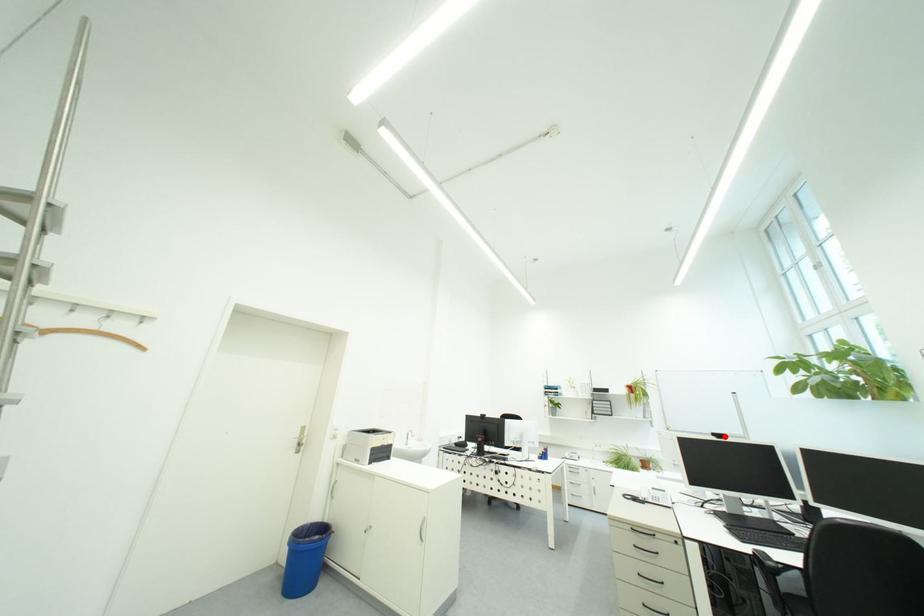
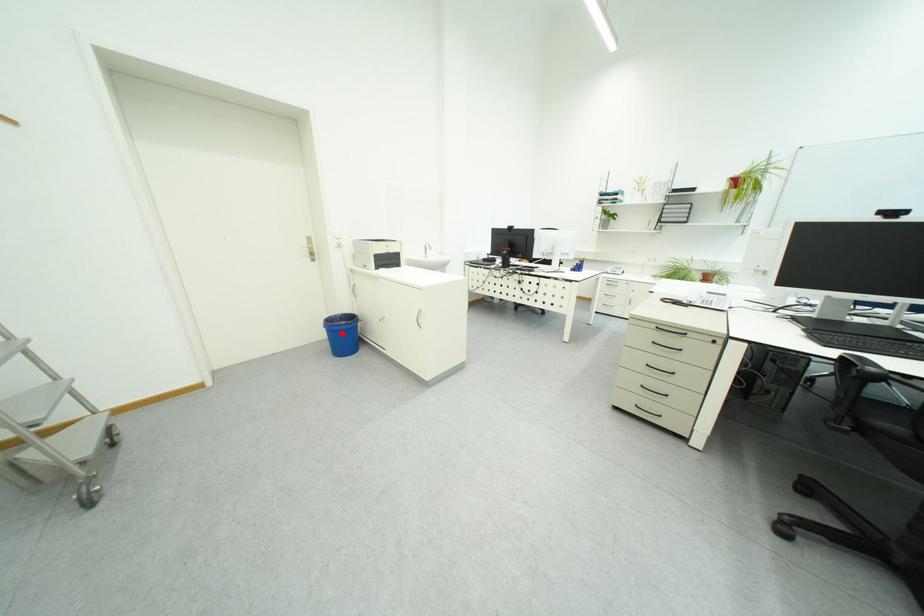
Looking at this image, I am providing you with two images of the same scene from different viewpoints. A red point is marked on the first image and another point is marked on the second image. Are the points marked in image1 and image2 representing the same 3D position?

No